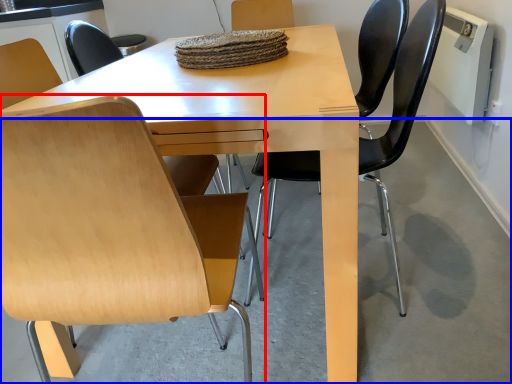
Question: Which object is further to the camera taking this photo, chair (highlighted by a red box) or concrete (highlighted by a blue box)?

Choices:
 (A) chair
 (B) concrete

Answer: (B)